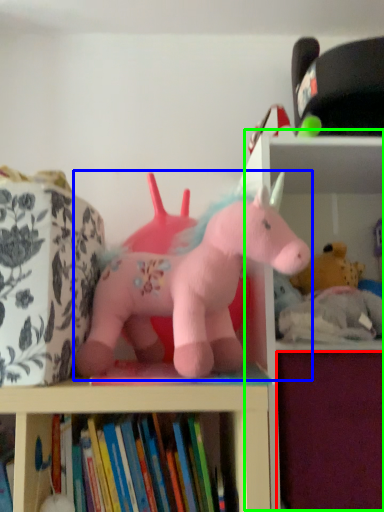
Question: Estimate the real-world distances between objects in this image. Which object is closer to drawer (highlighted by a red box), toy (highlighted by a blue box) or bookshelf (highlighted by a green box)?

Choices:
 (A) toy
 (B) bookshelf

Answer: (A)